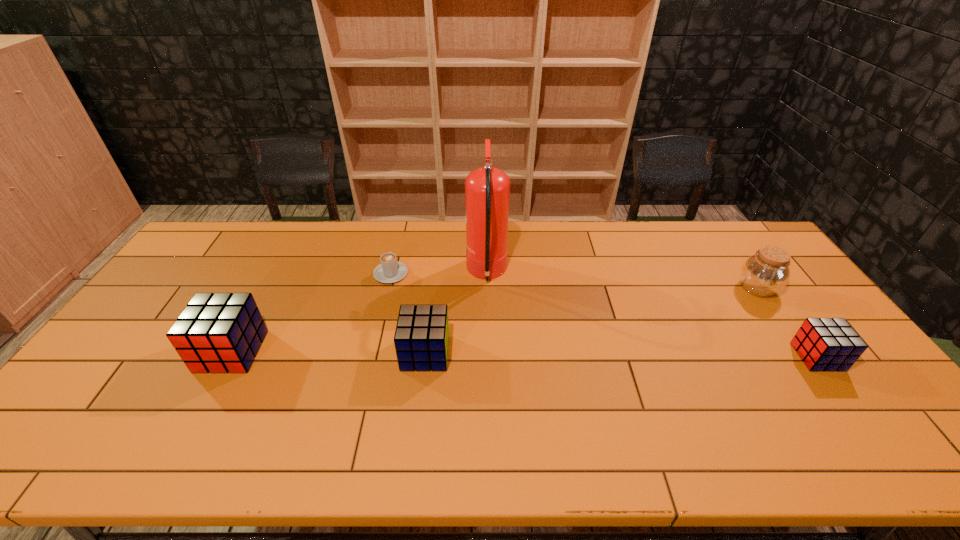
The width and height of the screenshot is (960, 540). I want to click on vacant region between the rightmost cube and the jar, so click(787, 322).

Locate an element on the screen. The image size is (960, 540). free spot between the third object from left to right and the jar is located at coordinates (x=591, y=321).

The width and height of the screenshot is (960, 540). Identify the location of unoccupied position between the tallest object and the shortest cube. (652, 315).

Find the location of `vacant area between the fourth object from right to left and the fifth tallest object`. vacant area between the fourth object from right to left and the fifth tallest object is located at coordinates (621, 355).

Where is `vacant space that's between the jar and the shortest cube`? vacant space that's between the jar and the shortest cube is located at coordinates (787, 322).

Locate an element on the screen. The width and height of the screenshot is (960, 540). free space between the shortest object and the jar is located at coordinates (574, 281).

Where is `blank region between the second cube from left to right and the jar`? blank region between the second cube from left to right and the jar is located at coordinates (591, 321).

Image resolution: width=960 pixels, height=540 pixels. In order to click on free space between the fourth object from right to left and the tallest cube in this screenshot , I will do `click(328, 352)`.

Point out which object is positioned as the fifth nearest to the third object from right to left. Please provide its 2D coordinates. Your answer should be formatted as a tuple, i.e. [(x, y)], where the tuple contains the x and y coordinates of a point satisfying the conditions above.

[(824, 344)]

At what (x,y) coordinates should I click in order to perform the action: click on object identified as the fourth closest to the second object from left to right. Please return your answer as a coordinate pair (x, y). The height and width of the screenshot is (540, 960). Looking at the image, I should click on (767, 272).